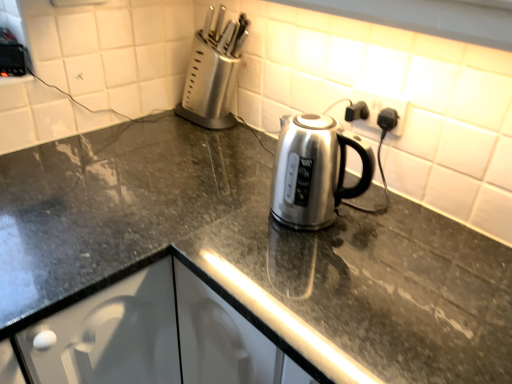
Question: Should I look upward or downward to see black plastic outlet at upper right?

Choices:
 (A) down
 (B) up

Answer: (B)

Question: From a real-world perspective, is slate gray granite countertop at center located beneath satin silver knife block at upper left?

Choices:
 (A) yes
 (B) no

Answer: (A)

Question: Does slate gray granite countertop at center have a smaller size compared to satin silver knife block at upper left?

Choices:
 (A) yes
 (B) no

Answer: (B)

Question: Is slate gray granite countertop at center directly adjacent to satin silver knife block at upper left?

Choices:
 (A) no
 (B) yes

Answer: (A)

Question: From a real-world perspective, is slate gray granite countertop at center on top of satin silver knife block at upper left?

Choices:
 (A) yes
 (B) no

Answer: (B)

Question: Are slate gray granite countertop at center and satin silver knife block at upper left located far from each other?

Choices:
 (A) yes
 (B) no

Answer: (B)

Question: Considering the relative positions of slate gray granite countertop at center and satin silver knife block at upper left in the image provided, is slate gray granite countertop at center to the left of satin silver knife block at upper left from the viewer's perspective?

Choices:
 (A) yes
 (B) no

Answer: (B)

Question: Can you confirm if black plastic outlet at upper right is wider than slate gray granite countertop at center?

Choices:
 (A) yes
 (B) no

Answer: (B)

Question: From the image's perspective, does black plastic outlet at upper right appear lower than slate gray granite countertop at center?

Choices:
 (A) yes
 (B) no

Answer: (B)

Question: Is black plastic outlet at upper right next to slate gray granite countertop at center?

Choices:
 (A) no
 (B) yes

Answer: (A)

Question: Is black plastic outlet at upper right completely or partially outside of slate gray granite countertop at center?

Choices:
 (A) yes
 (B) no

Answer: (A)

Question: Does black plastic outlet at upper right have a greater height compared to slate gray granite countertop at center?

Choices:
 (A) yes
 (B) no

Answer: (B)

Question: From a real-world perspective, is black plastic outlet at upper right under slate gray granite countertop at center?

Choices:
 (A) yes
 (B) no

Answer: (B)

Question: Is black plastic outlet at upper right facing away from satin silver knife block at upper left?

Choices:
 (A) no
 (B) yes

Answer: (A)